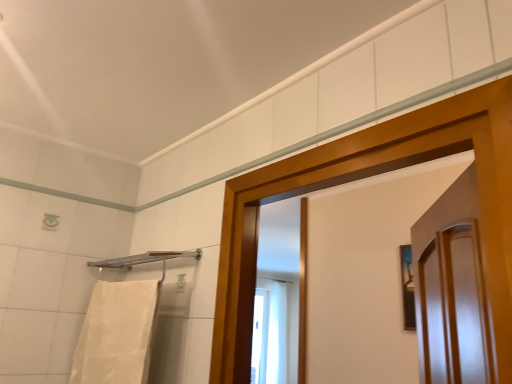
The image size is (512, 384). What do you see at coordinates (117, 334) in the screenshot?
I see `white cotton towel at left` at bounding box center [117, 334].

The width and height of the screenshot is (512, 384). I want to click on white cotton towel at left, so click(x=117, y=334).

What is the approximate width of silver metallic towel bar at upper left?

The width of silver metallic towel bar at upper left is 7.26 inches.

Identify the location of silver metallic towel bar at upper left. (145, 260).

Describe the element at coordinates (145, 260) in the screenshot. I see `silver metallic towel bar at upper left` at that location.

Find the location of `white cotton towel at left`. white cotton towel at left is located at coordinates (117, 334).

Consider the image. Does white cotton towel at left appear on the right side of silver metallic towel bar at upper left?

In fact, white cotton towel at left is to the left of silver metallic towel bar at upper left.

Is white cotton towel at left further to the viewer compared to silver metallic towel bar at upper left?

No, it is not.

Considering the positions of points (80, 366) and (197, 255), is point (80, 366) closer to camera compared to point (197, 255)?

No, it is not.

From the image's perspective, who appears lower, white cotton towel at left or silver metallic towel bar at upper left?

white cotton towel at left.

From a real-world perspective, is white cotton towel at left positioned above or below silver metallic towel bar at upper left?

Result: Clearly, from a real-world perspective, white cotton towel at left is below silver metallic towel bar at upper left.

Considering the sizes of objects white cotton towel at left and silver metallic towel bar at upper left in the image provided, who is wider, white cotton towel at left or silver metallic towel bar at upper left?

With larger width is silver metallic towel bar at upper left.

Considering the relative sizes of white cotton towel at left and silver metallic towel bar at upper left in the image provided, is white cotton towel at left shorter than silver metallic towel bar at upper left?

No.

Considering the sizes of objects white cotton towel at left and silver metallic towel bar at upper left in the image provided, who is bigger, white cotton towel at left or silver metallic towel bar at upper left?

With larger size is white cotton towel at left.

Is white cotton towel at left spatially inside silver metallic towel bar at upper left, or outside of it?

white cotton towel at left cannot be found inside silver metallic towel bar at upper left.

Is white cotton towel at left far away from silver metallic towel bar at upper left?

No.

Is white cotton towel at left oriented towards silver metallic towel bar at upper left?

No, white cotton towel at left does not turn towards silver metallic towel bar at upper left.

How much distance is there between white cotton towel at left and silver metallic towel bar at upper left?

white cotton towel at left is 9.64 inches away from silver metallic towel bar at upper left.

Identify the location of towel bar located above the white cotton towel at left (from the image's perspective). (145, 260).

Is silver metallic towel bar at upper left at the right side of white cotton towel at left?

Yes, silver metallic towel bar at upper left is to the right of white cotton towel at left.

Considering their positions, is silver metallic towel bar at upper left located in front of or behind white cotton towel at left?

Clearly, silver metallic towel bar at upper left is behind white cotton towel at left.

Considering the points (90, 264) and (131, 383), which point is behind, point (90, 264) or point (131, 383)?

The point (90, 264) is farther from the camera.

From the image's perspective, is silver metallic towel bar at upper left located above or below white cotton towel at left?

From the image's perspective, silver metallic towel bar at upper left appears above white cotton towel at left.

From a real-world perspective, between silver metallic towel bar at upper left and white cotton towel at left, who is vertically lower?

white cotton towel at left, from a real-world perspective.

Considering the sizes of objects silver metallic towel bar at upper left and white cotton towel at left in the image provided, who is wider, silver metallic towel bar at upper left or white cotton towel at left?

With larger width is silver metallic towel bar at upper left.

Can you confirm if silver metallic towel bar at upper left is shorter than white cotton towel at left?

Indeed, silver metallic towel bar at upper left has a lesser height compared to white cotton towel at left.

Is silver metallic towel bar at upper left bigger or smaller than white cotton towel at left?

In the image, silver metallic towel bar at upper left appears to be smaller than white cotton towel at left.

Is silver metallic towel bar at upper left not inside white cotton towel at left?

Yes, silver metallic towel bar at upper left is outside of white cotton towel at left.

Is silver metallic towel bar at upper left directly adjacent to white cotton towel at left?

silver metallic towel bar at upper left and white cotton towel at left are not in contact.

From the picture: Is silver metallic towel bar at upper left oriented away from white cotton towel at left?

No, white cotton towel at left is not at the back of silver metallic towel bar at upper left.

At what (x,y) coordinates should I click in order to perform the action: click on bath towel that appears in front of the silver metallic towel bar at upper left. Please return your answer as a coordinate pair (x, y). Looking at the image, I should click on (117, 334).

Identify the location of bath towel in front of the silver metallic towel bar at upper left. (117, 334).

The height and width of the screenshot is (384, 512). Identify the location of towel bar lying on the right of white cotton towel at left. (145, 260).